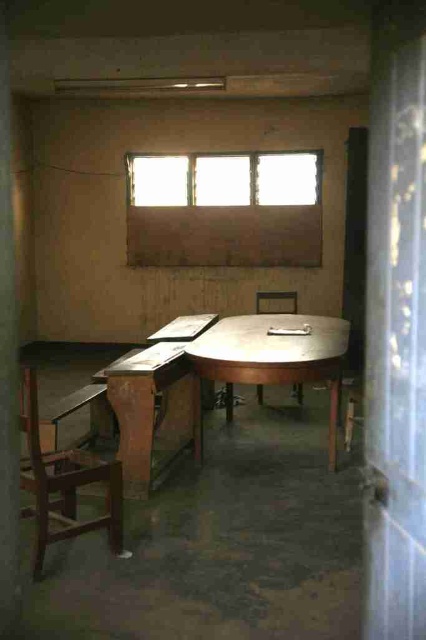
Question: Which of the following is the farthest from the observer?

Choices:
 (A) wooden table at center
 (B) matte wooden window at upper center
 (C) wooden at left
 (D) wooden chair at center

Answer: (B)

Question: Is matte wooden window at upper center above wooden chair at center?

Choices:
 (A) no
 (B) yes

Answer: (B)

Question: Based on their relative distances, which object is nearer to the wooden chair at center?

Choices:
 (A) wooden table at center
 (B) metallic polished table at center
 (C) wooden at left

Answer: (B)

Question: Which object is the farthest from the wooden table at center?

Choices:
 (A) matte wooden window at upper center
 (B) metallic polished table at center
 (C) wooden at left
 (D) wooden chair at center

Answer: (A)

Question: Is metallic polished table at center behind wooden at left?

Choices:
 (A) no
 (B) yes

Answer: (B)

Question: Can you confirm if matte wooden window at upper center is positioned above wooden table at center?

Choices:
 (A) yes
 (B) no

Answer: (A)